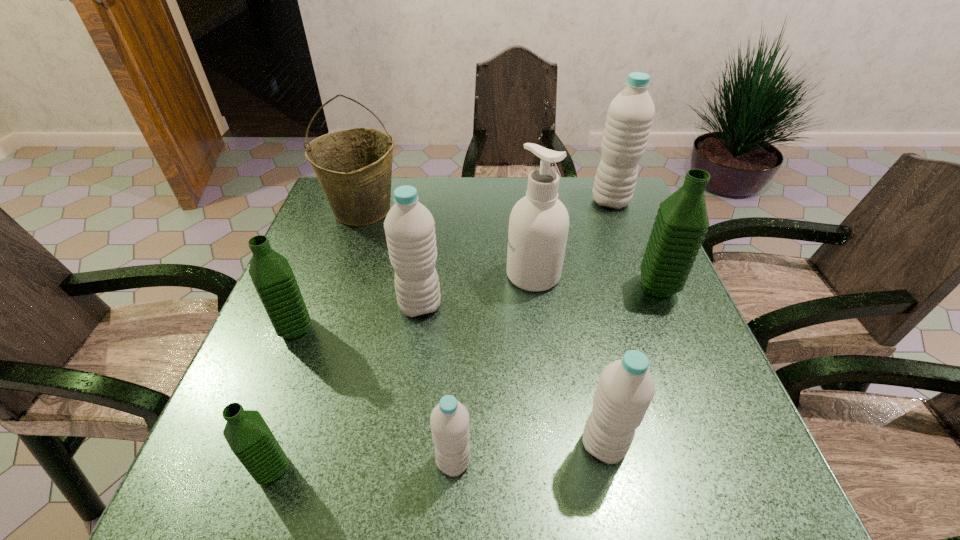
Find the location of a particular element. The width and height of the screenshot is (960, 540). the fifth water bottle from left to right is located at coordinates (626, 388).

Find the location of `the smallest white water bottle`. the smallest white water bottle is located at coordinates (449, 420).

Locate an element on the screen. the fourth water bottle from left to right is located at coordinates (449, 420).

At what (x,y) coordinates should I click in order to perform the action: click on the nearest green water bottle. Please return your answer as a coordinate pair (x, y). The image size is (960, 540). Looking at the image, I should click on (249, 437).

Where is `blank space located on the front of the rightmost white water bottle`? The width and height of the screenshot is (960, 540). blank space located on the front of the rightmost white water bottle is located at coordinates (648, 297).

Locate an element on the screen. free space located 0.070m on the right of the wine bucket is located at coordinates (426, 211).

Where is `vacant space positioned 0.060m on the front label of the cleansing agent`? The height and width of the screenshot is (540, 960). vacant space positioned 0.060m on the front label of the cleansing agent is located at coordinates (481, 275).

Identify the location of vacant space located on the front label of the cleansing agent. (423, 275).

Image resolution: width=960 pixels, height=540 pixels. I want to click on vacant space situated 0.290m on the front label of the cleansing agent, so click(x=386, y=275).

In order to click on vacant space situated 0.380m on the left of the biggest green water bottle in this screenshot , I will do `click(475, 287)`.